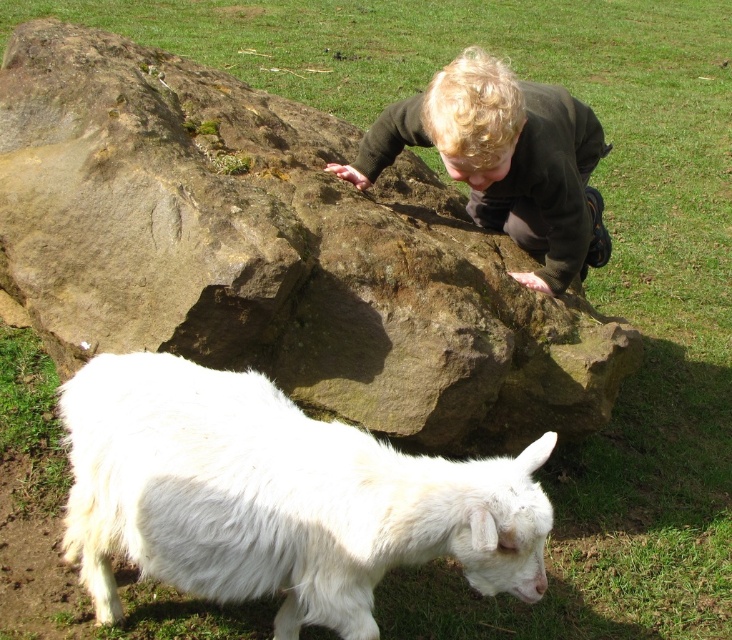
Is white fluffy goat at lower left thinner than dark brown sweater at upper center?

In fact, white fluffy goat at lower left might be wider than dark brown sweater at upper center.

Find the location of a particular element. white fluffy goat at lower left is located at coordinates (276, 497).

Who is positioned more to the left, brown rough rock at center or white fluffy goat at lower left?

Positioned to the left is white fluffy goat at lower left.

Does brown rough rock at center come behind white fluffy goat at lower left?

Yes, it is behind white fluffy goat at lower left.

Between point (89, 260) and point (367, 577), which one is positioned in front?

Point (367, 577) is more forward.

I want to click on brown rough rock at center, so click(274, 252).

At what (x,y) coordinates should I click in order to perform the action: click on brown rough rock at center. Please return your answer as a coordinate pair (x, y). This screenshot has height=640, width=732. Looking at the image, I should click on (274, 252).

Is brown rough rock at center behind dark brown sweater at upper center?

No, it is in front of dark brown sweater at upper center.

What do you see at coordinates (274, 252) in the screenshot?
I see `brown rough rock at center` at bounding box center [274, 252].

Locate an element on the screen. brown rough rock at center is located at coordinates (x=274, y=252).